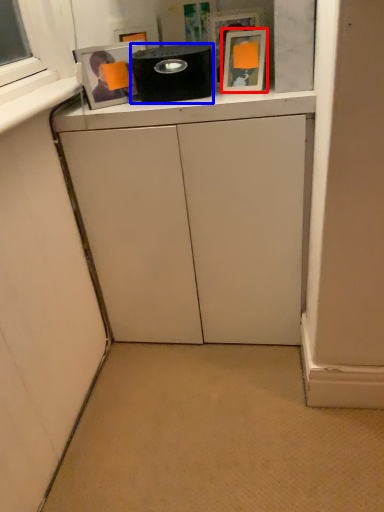
Question: Which object appears closest to the camera in this image, picture frame (highlighted by a red box) or appliance (highlighted by a blue box)?

Choices:
 (A) picture frame
 (B) appliance

Answer: (A)